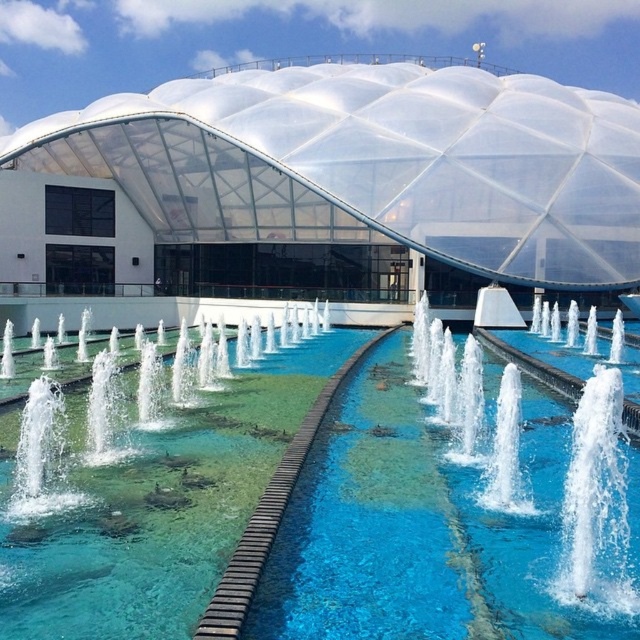
Question: From the image, what is the correct spatial relationship of transparent plastic dome at center in relation to clear water jets at center?

Choices:
 (A) left
 (B) right

Answer: (A)

Question: Can you confirm if clear glass swimming pool at center is thinner than clear water jets at center?

Choices:
 (A) no
 (B) yes

Answer: (A)

Question: Which point appears closest to the camera in this image?

Choices:
 (A) (589, 545)
 (B) (456, 141)
 (C) (344, 502)

Answer: (A)

Question: Which of the following is the farthest from the observer?

Choices:
 (A) clear glass swimming pool at center
 (B) clear water jets at center
 (C) transparent plastic dome at center

Answer: (C)

Question: Can you confirm if transparent plastic dome at center is positioned above clear water jets at center?

Choices:
 (A) no
 (B) yes

Answer: (B)

Question: Which is farther from the clear glass swimming pool at center?

Choices:
 (A) clear water jets at center
 (B) transparent plastic dome at center

Answer: (B)